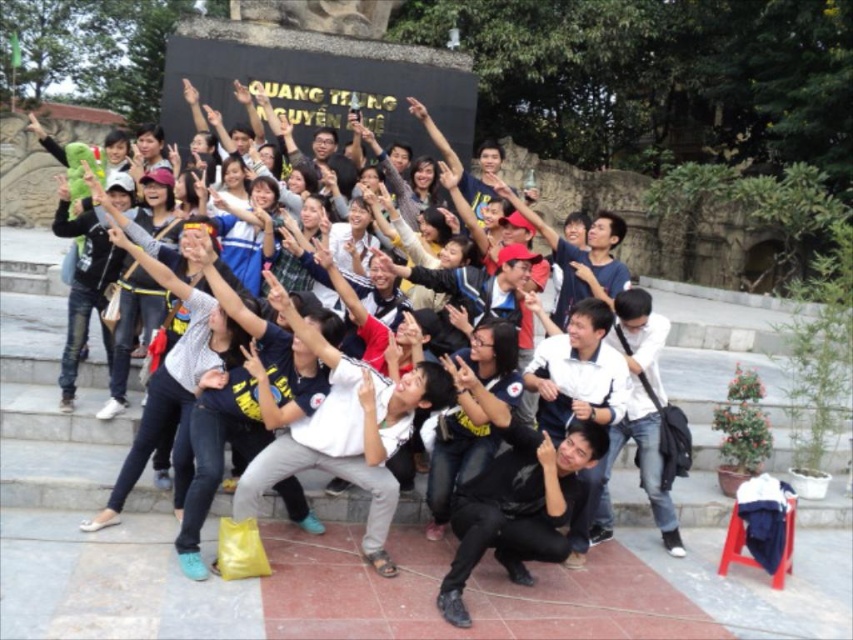
Question: Which of the following is the farthest from the observer?

Choices:
 (A) matte black hand at center
 (B) white matte shirt at center

Answer: (A)

Question: Is white matte shirt at center below smooth skin hand at center?

Choices:
 (A) no
 (B) yes

Answer: (B)

Question: Can you confirm if matte black hand at center is positioned above smooth skin hand at center?

Choices:
 (A) yes
 (B) no

Answer: (B)

Question: Considering the real-world distances, which object is farthest from the white matte shirt at center?

Choices:
 (A) matte black hand at center
 (B) smooth skin hand at center

Answer: (B)

Question: Which object is closer to the camera taking this photo?

Choices:
 (A) smooth skin hand at center
 (B) matte black hand at center

Answer: (B)

Question: Is white matte shirt at center wider than matte black hand at center?

Choices:
 (A) no
 (B) yes

Answer: (B)